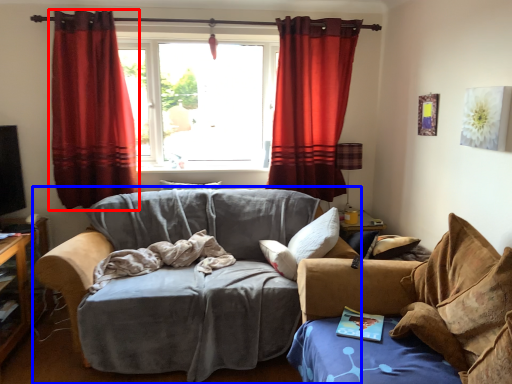
Question: Which of the following is the closest to the observer, curtain (highlighted by a red box) or studio couch (highlighted by a blue box)?

Choices:
 (A) curtain
 (B) studio couch

Answer: (B)